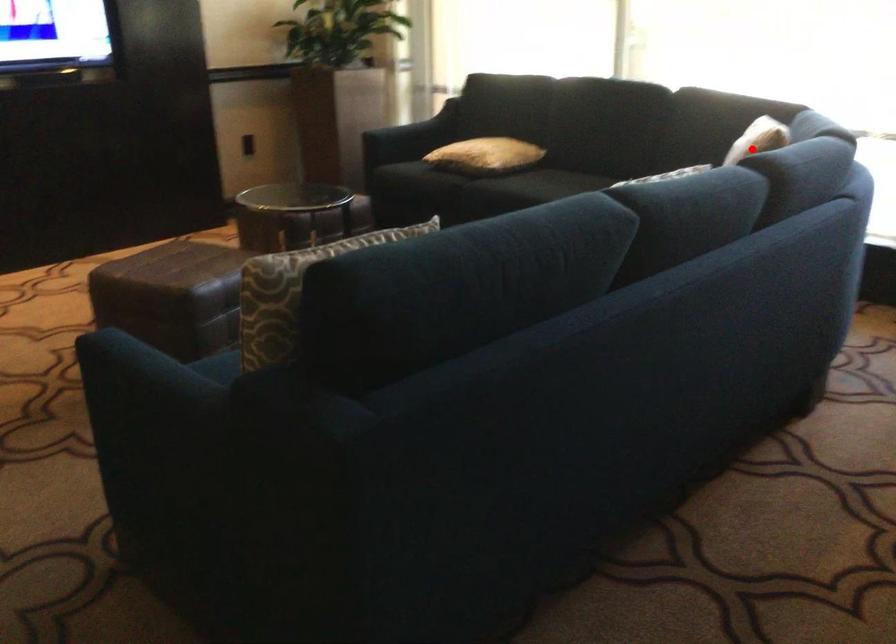
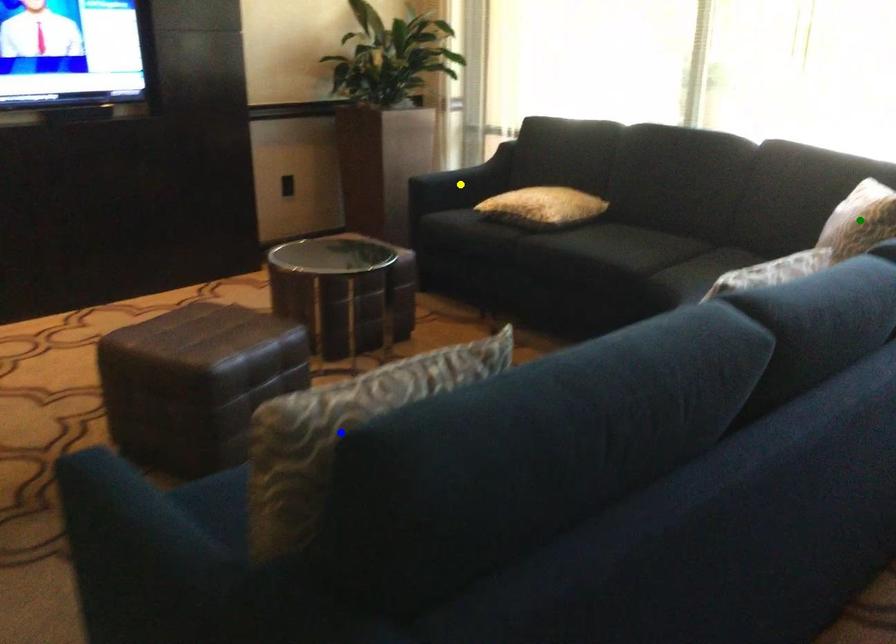
Question: I am providing you with two images of the same scene from different viewpoints. A red point is marked on the first image. You are given multiple points on the second image. Which point in image 2 represents the same 3d spot as the red point in image 1?

Choices:
 (A) yellow point
 (B) blue point
 (C) green point

Answer: (C)